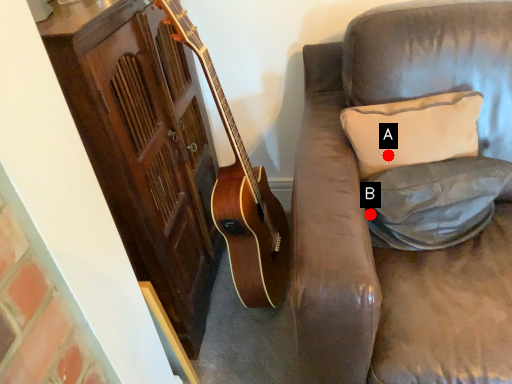
Question: Two points are circled on the image, labeled by A and B beside each circle. Which point is further to the camera?

Choices:
 (A) A is further
 (B) B is further

Answer: (A)